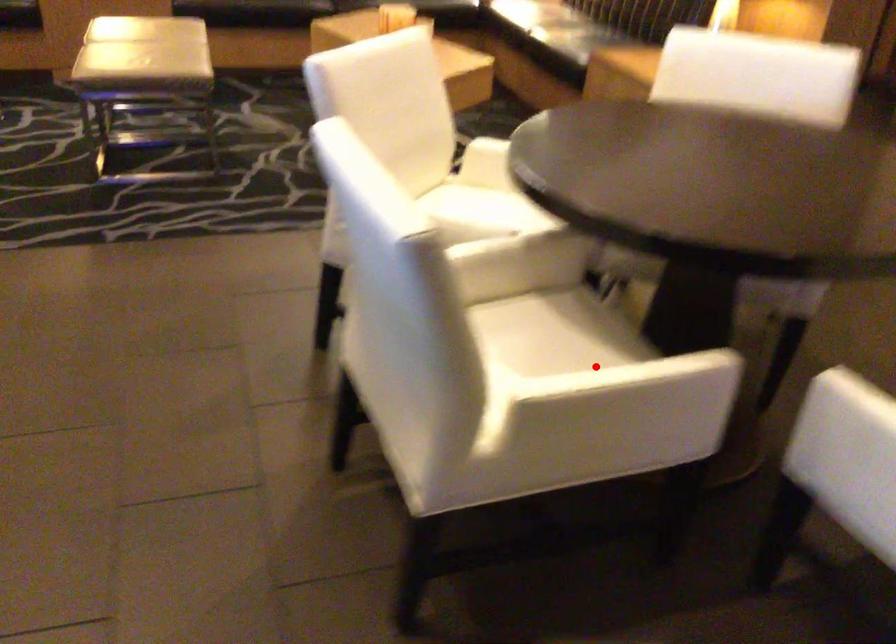
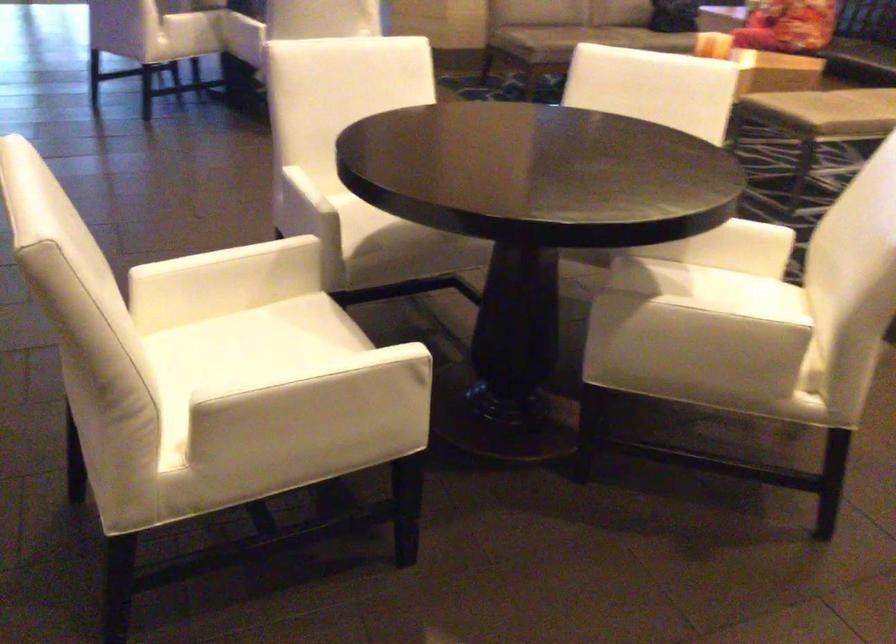
Locate, in the second image, the point that corresponds to the highlighted location in the first image.

(372, 223)